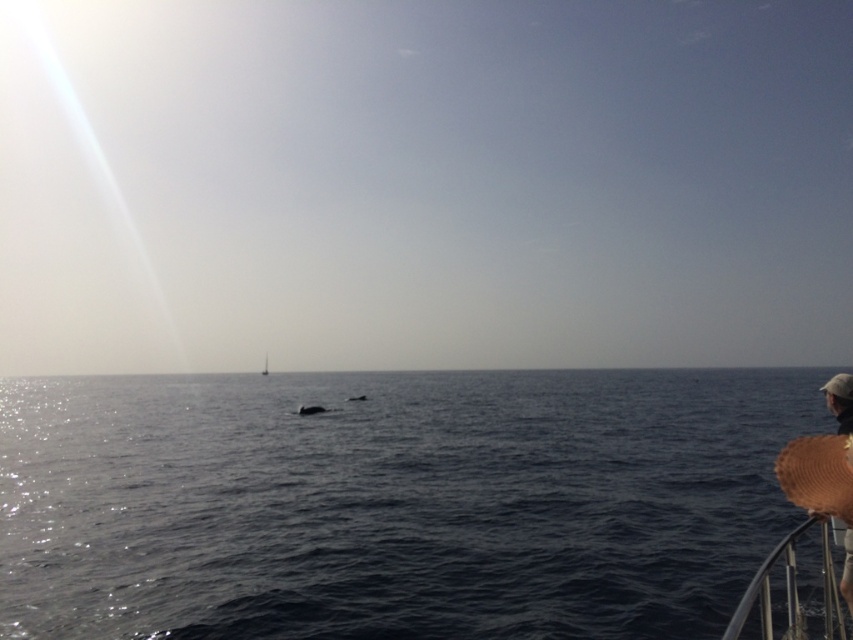
You are standing on a cliff overlooking the ocean and see the dark blue water at center. If you want to throw a stone into the water, which direction should you aim for based on its position?

The dark blue water at center is located at point coordinates approximately 0.787 on the x axis and 0.461 on the y axis, so you should aim towards the lower right direction to hit the water.

You are standing on a beach looking at the seascape. You see a person wearing two hats, the brown woven hat at lower right and the brown straw hat at lower right. Which hat is positioned higher on the person?

The brown woven hat at lower right is located above the brown straw hat at lower right, so it is positioned higher on the person.